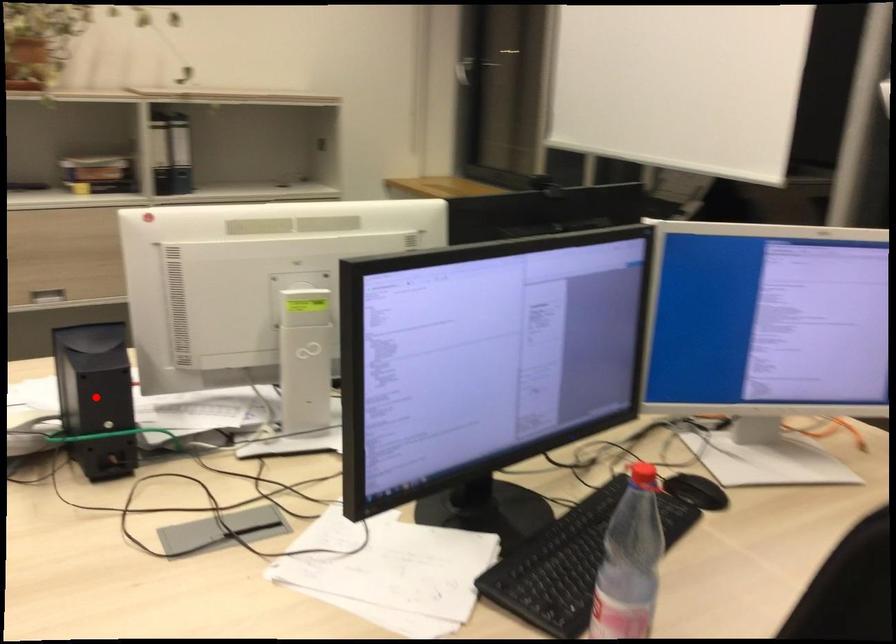
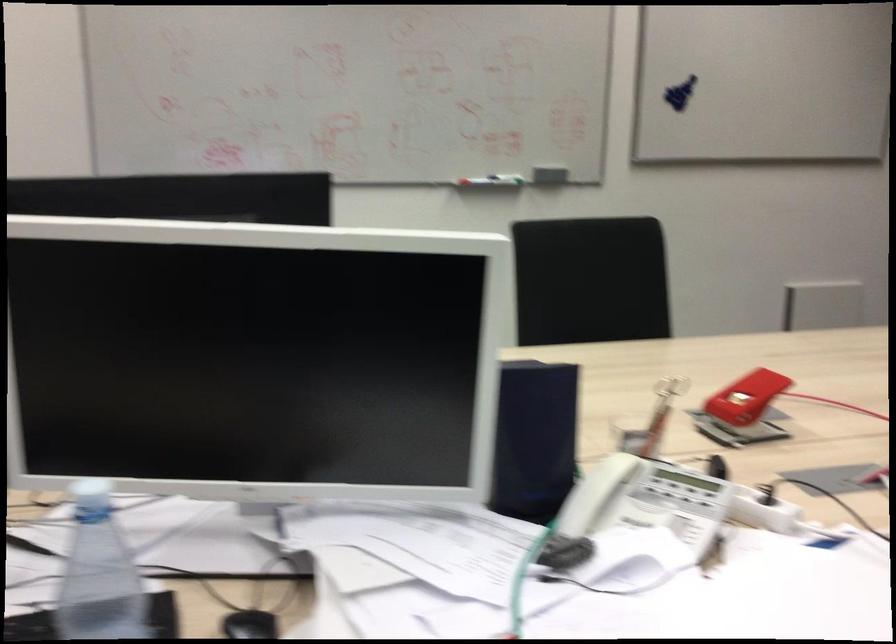
Question: I am providing you with two images of the same scene from different viewpoints. A red point is marked on the first image. Is the red point's position out of view in image 2?

Choices:
 (A) Yes
 (B) No

Answer: (A)